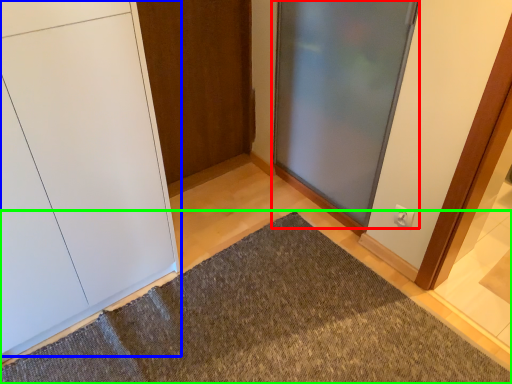
Question: Which is farther away from door (highlighted by a red box)? door (highlighted by a blue box) or doormat (highlighted by a green box)?

Choices:
 (A) door
 (B) doormat

Answer: (A)